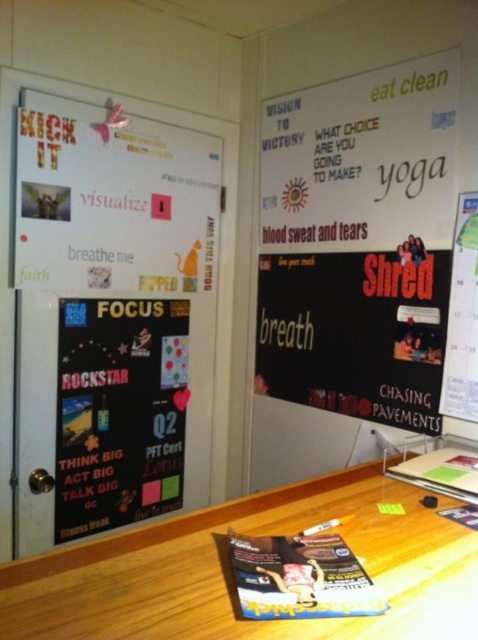
Is wooden table at lower center smaller than matte black poster at center?

Yes.

Which is more to the right, wooden table at lower center or matte black poster at center?

wooden table at lower center is more to the right.

This screenshot has width=478, height=640. What do you see at coordinates (231, 573) in the screenshot? I see `wooden table at lower center` at bounding box center [231, 573].

Where is `wooden table at lower center`? The image size is (478, 640). wooden table at lower center is located at coordinates (231, 573).

Between white matte bulletin board at upper right and matte black poster at upper right, which one is positioned higher?

white matte bulletin board at upper right is above.

Is point (335, 179) closer to viewer compared to point (455, 304)?

No, it is behind (455, 304).

Identify the location of white matte bulletin board at upper right. (358, 243).

Who is positioned more to the right, matte black poster at center or matte black poster at upper right?

matte black poster at upper right is more to the right.

Is point (148, 300) closer to camera compared to point (476, 304)?

No.

The width and height of the screenshot is (478, 640). What do you see at coordinates (119, 412) in the screenshot?
I see `matte black poster at center` at bounding box center [119, 412].

Identify the location of matte black poster at center. This screenshot has height=640, width=478. (119, 412).